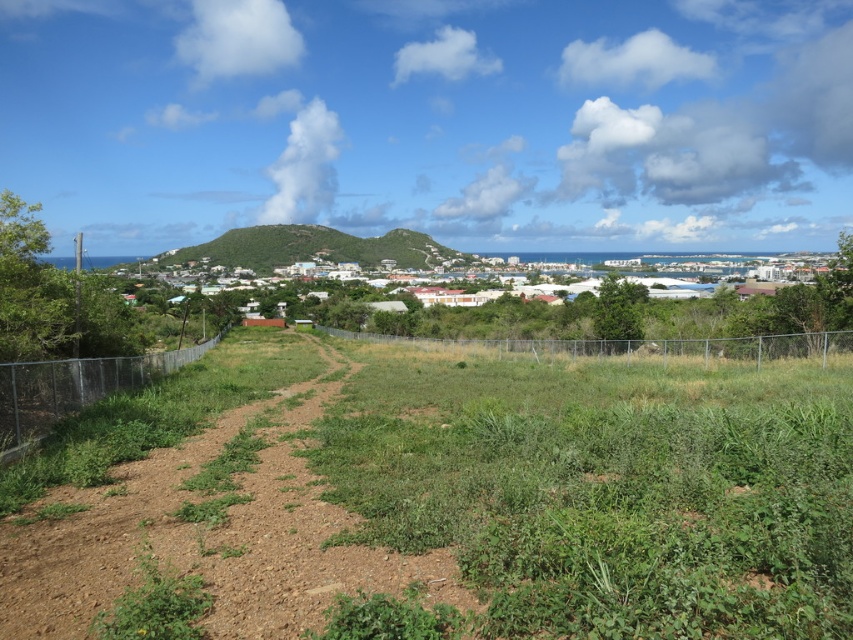
Question: Which object is positioned closest to the metallic chain-link fence at center?

Choices:
 (A) green matte buildings at center
 (B) metallic chain-link fence at left
 (C) green grassy hill at center

Answer: (B)

Question: Which object is closer to the camera taking this photo?

Choices:
 (A) metallic chain-link fence at center
 (B) green grassy hill at center

Answer: (A)

Question: Which point is closer to the camera?

Choices:
 (A) metallic chain-link fence at left
 (B) green grassy hill at center
 (C) metallic chain-link fence at center
 (D) green matte buildings at center

Answer: (A)

Question: Can you confirm if green matte buildings at center is bigger than metallic chain-link fence at left?

Choices:
 (A) no
 (B) yes

Answer: (B)

Question: Is green matte buildings at center wider than green grassy hill at center?

Choices:
 (A) no
 (B) yes

Answer: (B)

Question: Can you confirm if green matte buildings at center is positioned above metallic chain-link fence at left?

Choices:
 (A) yes
 (B) no

Answer: (A)